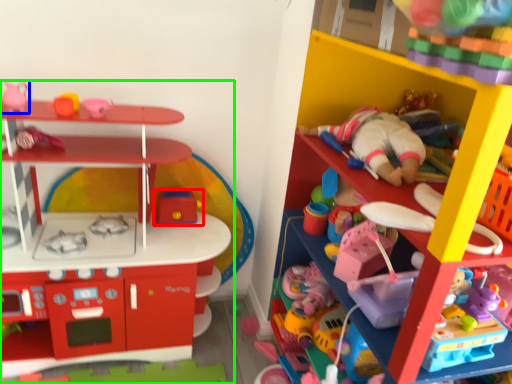
Question: Which object is positioned farthest from toy (highlighted by a red box)? Select from toy (highlighted by a blue box) and toy (highlighted by a green box).

Choices:
 (A) toy
 (B) toy

Answer: (A)